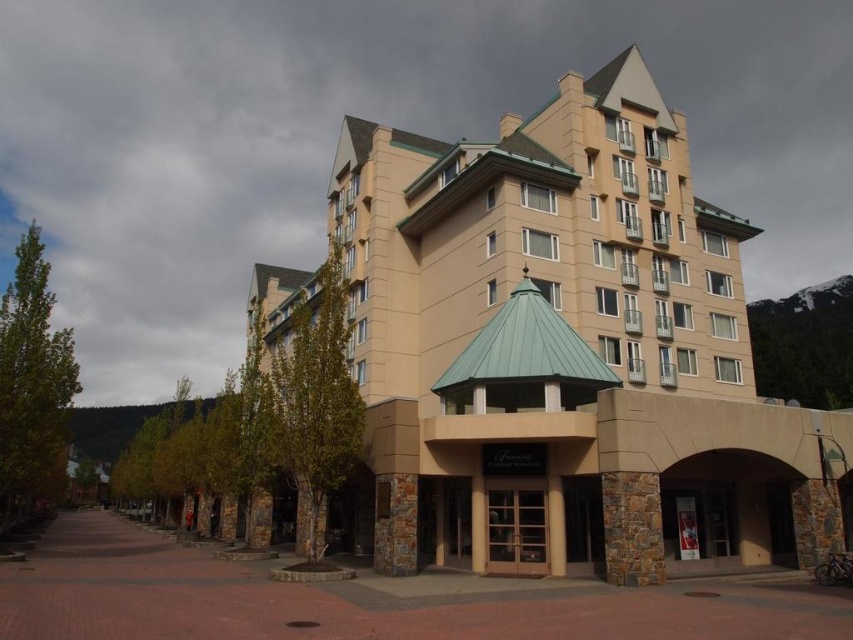
You are a delivery person arriving at the beige stone building at center. You need to enter through the brown wooden door at center. Is the door accessible from the current ground level without needing to climb stairs?

The beige stone building at center is above the brown wooden door at center, which means the door is located at ground level. Therefore, you can enter without needing to climb stairs.

You are standing at the entrance of the building and want to walk towards the point labeled as point (529, 563). Which direction should you turn to face the point labeled point (683, 397) instead?

To face point (683, 397) from your current position at the entrance, you should turn left since point (683, 397) is in front of point (529, 563).

You are standing on the paved walkway in front of the beige stone building at center and the brown wooden door at center. Which object is positioned further to the right from your perspective?

The brown wooden door at center is positioned further to the right because the beige stone building at center is to the left of it.